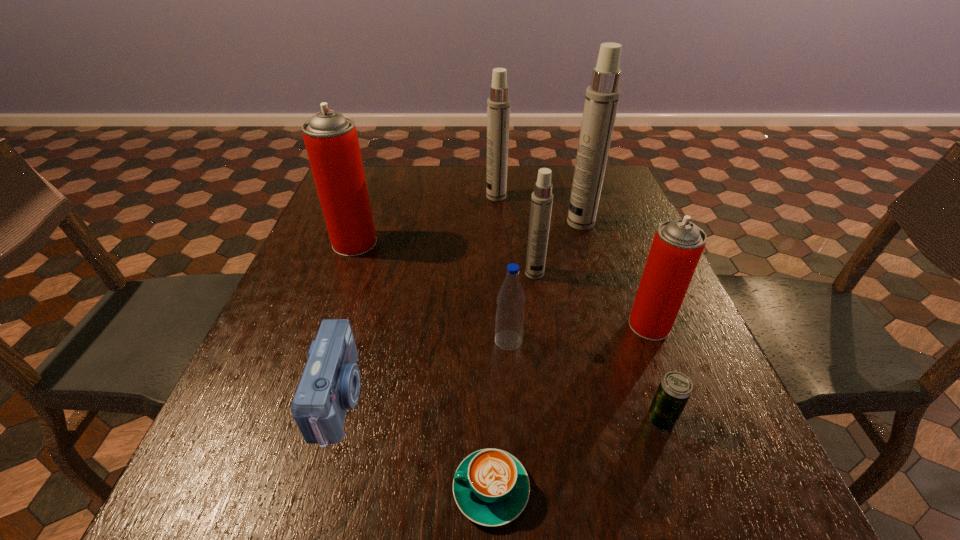
Locate an element on the screen. Image resolution: width=960 pixels, height=540 pixels. camera positioned at the left edge is located at coordinates (330, 383).

Where is `beer can located at the right edge`? beer can located at the right edge is located at coordinates (675, 388).

In the image, there is a desktop. Where is `vacant space at the far edge`? This screenshot has height=540, width=960. vacant space at the far edge is located at coordinates (512, 188).

In the image, there is a desktop. Where is `vacant space at the near edge`? This screenshot has width=960, height=540. vacant space at the near edge is located at coordinates (297, 534).

You are a GUI agent. You are given a task and a screenshot of the screen. Output one action in this format:
    pyautogui.click(x=<x>, y=<y>)
    Task: Click on the vacant space at the left edge of the desktop
    The height and width of the screenshot is (540, 960).
    Given the screenshot: What is the action you would take?
    pyautogui.click(x=345, y=292)

Image resolution: width=960 pixels, height=540 pixels. What are the coordinates of `vacant space at the right edge` in the screenshot? It's located at (618, 279).

Locate an element on the screen. This screenshot has height=540, width=960. free spot at the near left corner of the desktop is located at coordinates (258, 508).

Image resolution: width=960 pixels, height=540 pixels. Find the location of `vacant region at the far right corner of the desktop`. vacant region at the far right corner of the desktop is located at coordinates (618, 176).

The image size is (960, 540). What are the coordinates of `vacant space at the near right corner` in the screenshot? It's located at (690, 521).

The width and height of the screenshot is (960, 540). In order to click on vacant area that lies between the fourth shortest object and the nearer red aerosol can in this screenshot , I will do `click(579, 333)`.